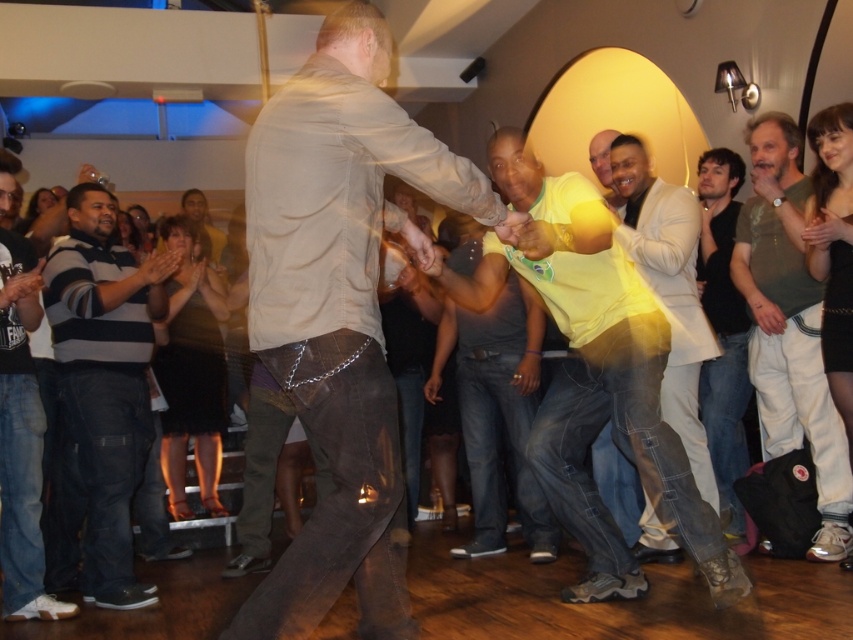
Who is taller, yellow cotton t-shirt at center or dark blue jeans at left?

dark blue jeans at left is taller.

Looking at this image, does yellow cotton t-shirt at center appear over dark blue jeans at left?

Correct, yellow cotton t-shirt at center is located above dark blue jeans at left.

Measure the distance between yellow cotton t-shirt at center and camera.

yellow cotton t-shirt at center is 2.44 meters from camera.

Find the location of a particular element. yellow cotton t-shirt at center is located at coordinates (595, 374).

Does striped cotton shirt at left have a greater width compared to yellow t-shirt at center?

Incorrect, striped cotton shirt at left's width does not surpass yellow t-shirt at center's.

Does striped cotton shirt at left have a lesser height compared to yellow t-shirt at center?

No.

The image size is (853, 640). Describe the element at coordinates (105, 378) in the screenshot. I see `striped cotton shirt at left` at that location.

This screenshot has height=640, width=853. Find the location of `striped cotton shirt at left`. striped cotton shirt at left is located at coordinates (105, 378).

Does light beige shirt at center have a smaller size compared to light brown leather pants at right?

No, light beige shirt at center is not smaller than light brown leather pants at right.

Can you confirm if light beige shirt at center is shorter than light brown leather pants at right?

Yes.

Does point (347, 253) lie behind point (821, 461)?

No, (347, 253) is in front of (821, 461).

This screenshot has height=640, width=853. I want to click on light beige shirt at center, so click(x=339, y=314).